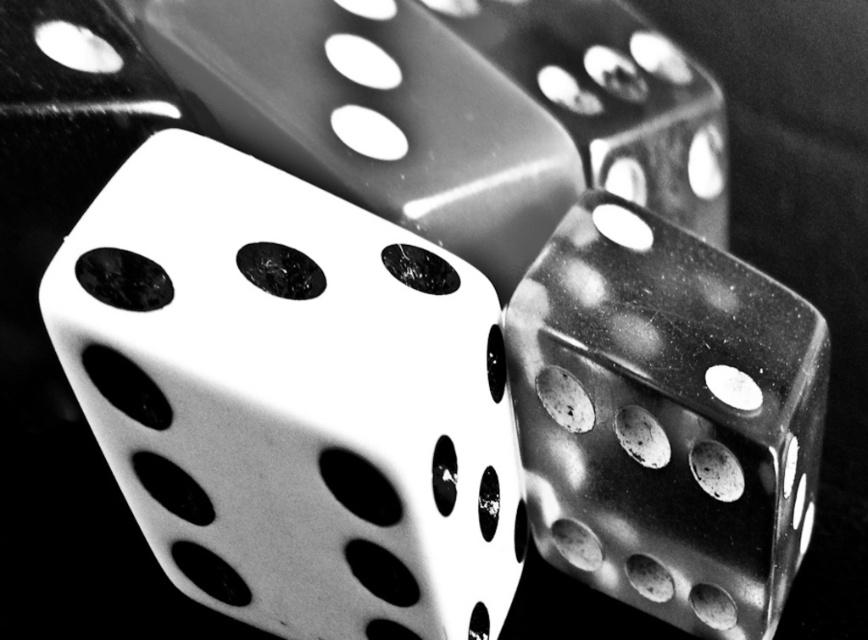
Can you confirm if white matte dice at center is shorter than metallic dice at center?

No.

Is white matte dice at center closer to the viewer compared to metallic dice at center?

Yes, it is.

Is point (41, 300) in front of point (721, 100)?

Yes, point (41, 300) is in front of point (721, 100).

Where is `white matte dice at center`? white matte dice at center is located at coordinates (293, 397).

Can you confirm if translucent plastic dice at center is positioned below metallic dice at center?

Indeed, translucent plastic dice at center is positioned under metallic dice at center.

Consider the image. Is translucent plastic dice at center closer to the viewer compared to metallic dice at center?

Yes, it is in front of metallic dice at center.

Find the location of a particular element. translucent plastic dice at center is located at coordinates (666, 419).

I want to click on translucent plastic dice at center, so click(x=666, y=419).

Does translucent plastic dice at center appear on the right side of white glossy dice at center?

Yes, translucent plastic dice at center is to the right of white glossy dice at center.

Between translucent plastic dice at center and white glossy dice at center, which one is positioned lower?

translucent plastic dice at center is lower down.

The width and height of the screenshot is (868, 640). In order to click on translucent plastic dice at center in this screenshot , I will do `click(666, 419)`.